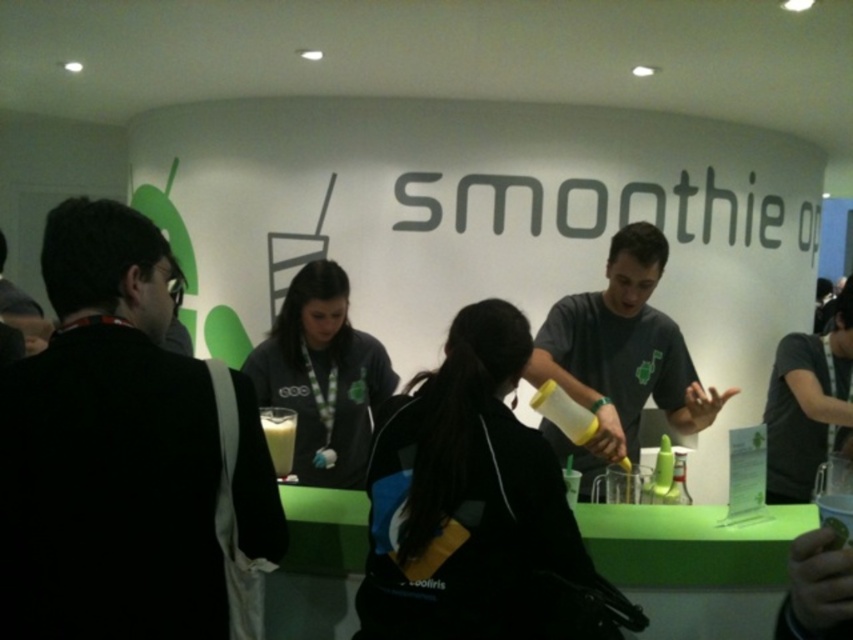
Can you confirm if black fabric jacket at left is positioned to the left of green matte cup at center?

Yes, black fabric jacket at left is to the left of green matte cup at center.

Who is taller, black fabric jacket at left or green matte cup at center?

Standing taller between the two is black fabric jacket at left.

Is point (74, 637) positioned after point (850, 515)?

That is True.

Where is `black fabric jacket at left`? black fabric jacket at left is located at coordinates click(x=120, y=452).

Can you confirm if dark gray t-shirt at right is smaller than green matte cup at center?

No, dark gray t-shirt at right is not smaller than green matte cup at center.

Is dark gray t-shirt at right bigger than green matte cup at center?

Indeed, dark gray t-shirt at right has a larger size compared to green matte cup at center.

Is point (775, 429) positioned before point (828, 499)?

No, it is not.

At what (x,y) coordinates should I click in order to perform the action: click on dark gray t-shirt at right. Please return your answer as a coordinate pair (x, y). Looking at the image, I should click on (807, 403).

Is matte gray shirt at center bigger than white opaque smoothie at center?

Correct, matte gray shirt at center is larger in size than white opaque smoothie at center.

From the picture: Who is more distant from viewer, (635,452) or (276,417)?

Point (635,452)

At what (x,y) coordinates should I click in order to perform the action: click on matte gray shirt at center. Please return your answer as a coordinate pair (x, y). Looking at the image, I should click on (619, 356).

Locate an element on the screen. matte gray shirt at center is located at coordinates (619, 356).